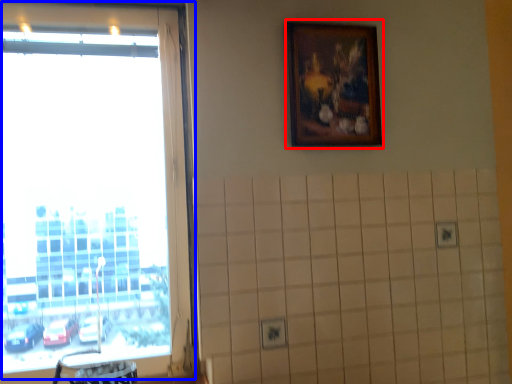
Question: Among these objects, which one is farthest to the camera, picture frame (highlighted by a red box) or window (highlighted by a blue box)?

Choices:
 (A) picture frame
 (B) window

Answer: (A)